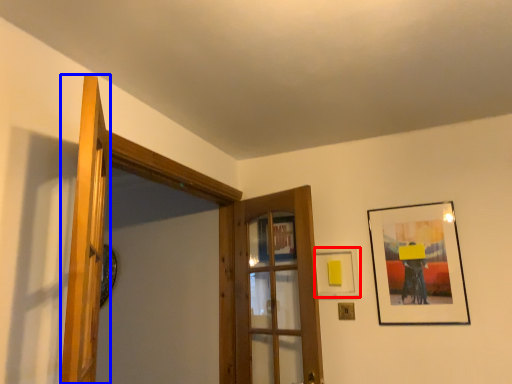
Question: Which of the following is the closest to the observer, picture frame (highlighted by a red box) or door (highlighted by a blue box)?

Choices:
 (A) picture frame
 (B) door

Answer: (B)